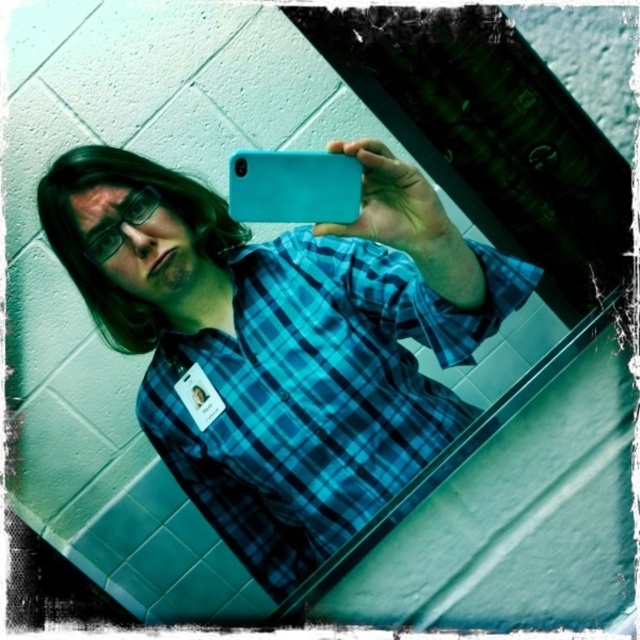
Question: Which point is farther to the camera?

Choices:
 (A) (321, 188)
 (B) (406, 384)

Answer: (B)

Question: Among these points, which one is nearest to the camera?

Choices:
 (A) (314, 280)
 (B) (305, 211)

Answer: (B)

Question: Does blue plaid shirt at center have a greater width compared to teal matte phone at center?

Choices:
 (A) no
 (B) yes

Answer: (B)

Question: Which point appears closest to the camera in this image?

Choices:
 (A) (275, 330)
 (B) (323, 198)

Answer: (B)

Question: Is blue plaid shirt at center wider than teal matte phone at center?

Choices:
 (A) no
 (B) yes

Answer: (B)

Question: Is blue plaid shirt at center above teal matte phone at center?

Choices:
 (A) no
 (B) yes

Answer: (A)